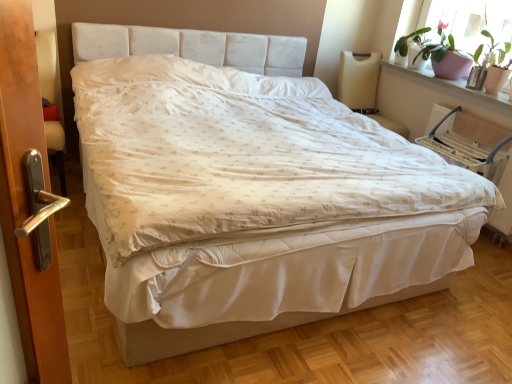
Question: Can you confirm if white fabric armchair at right, marked as the 2th armchair in a left-to-right arrangement, is wider than pink ceramic pot at upper right?

Choices:
 (A) yes
 (B) no

Answer: (B)

Question: Does white fabric armchair at right, marked as the 2th armchair in a left-to-right arrangement, lie in front of pink ceramic pot at upper right?

Choices:
 (A) no
 (B) yes

Answer: (B)

Question: Considering the relative positions of white fabric armchair at right, the 1th armchair viewed from the right, and pink ceramic pot at upper right in the image provided, is white fabric armchair at right, the 1th armchair viewed from the right, to the left of pink ceramic pot at upper right from the viewer's perspective?

Choices:
 (A) yes
 (B) no

Answer: (B)

Question: From a real-world perspective, is white fabric armchair at right, marked as the 2th armchair in a left-to-right arrangement, over pink ceramic pot at upper right?

Choices:
 (A) no
 (B) yes

Answer: (A)

Question: From the image's perspective, would you say white fabric armchair at right, marked as the 2th armchair in a left-to-right arrangement, is positioned over pink ceramic pot at upper right?

Choices:
 (A) no
 (B) yes

Answer: (A)

Question: Based on their positions, is pink ceramic pot at upper right located to the left or right of pink ceramic pot at upper right?

Choices:
 (A) right
 (B) left

Answer: (A)

Question: From a real-world perspective, is pink ceramic pot at upper right physically located above or below pink ceramic pot at upper right?

Choices:
 (A) above
 (B) below

Answer: (A)

Question: In terms of width, does pink ceramic pot at upper right look wider or thinner when compared to pink ceramic pot at upper right?

Choices:
 (A) thin
 (B) wide

Answer: (A)

Question: Would you say pink ceramic pot at upper right is inside or outside pink ceramic pot at upper right?

Choices:
 (A) outside
 (B) inside

Answer: (A)

Question: Looking at the image, does pink ceramic pot at upper right seem bigger or smaller compared to beige fabric armchair at upper right, the 1th armchair from the left?

Choices:
 (A) big
 (B) small

Answer: (B)

Question: Considering the positions of pink ceramic pot at upper right and beige fabric armchair at upper right, the 1th armchair from the left, in the image, is pink ceramic pot at upper right wider or thinner than beige fabric armchair at upper right, the 1th armchair from the left,?

Choices:
 (A) thin
 (B) wide

Answer: (A)

Question: Considering the positions of pink ceramic pot at upper right and beige fabric armchair at upper right, the second armchair in the right-to-left sequence, in the image, is pink ceramic pot at upper right taller or shorter than beige fabric armchair at upper right, the second armchair in the right-to-left sequence,?

Choices:
 (A) tall
 (B) short

Answer: (B)

Question: Choose the correct answer: Is pink ceramic pot at upper right inside beige fabric armchair at upper right, the second armchair in the right-to-left sequence, or outside it?

Choices:
 (A) inside
 (B) outside

Answer: (B)

Question: Considering the positions of beige fabric armchair at upper right, the second armchair in the right-to-left sequence, and white fabric bed frame at center in the image, is beige fabric armchair at upper right, the second armchair in the right-to-left sequence, wider or thinner than white fabric bed frame at center?

Choices:
 (A) wide
 (B) thin

Answer: (B)

Question: In terms of height, does beige fabric armchair at upper right, the second armchair in the right-to-left sequence, look taller or shorter compared to white fabric bed frame at center?

Choices:
 (A) tall
 (B) short

Answer: (A)